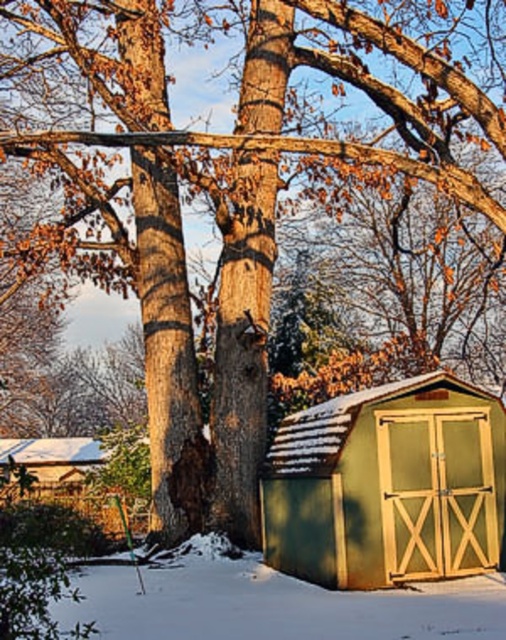
You are standing in the winter scene and want to store your winter gear. You have two options for storage locations near the tree. The green wood shed at lower right and the green wooden shed at lower left. Which shed is taller and thus has more storage space?

The green wood shed at lower right has a greater height compared to the green wooden shed at lower left, so it has more storage space.

You are standing at the center of the image and want to approach the green wood shed at lower right. Which direction should you move to reach it?

You should move towards the lower right direction to reach the green wood shed at lower right since it is located at point (388, 484).

You are standing in the winter scene and want to locate the point at coordinates (x=388, y=484). Based on the description, where exactly on the green wood shed at lower right would you find this point?

The point at coordinates (x=388, y=484) is located on the green wood shed at lower right, specifically on its surface or structure as described.